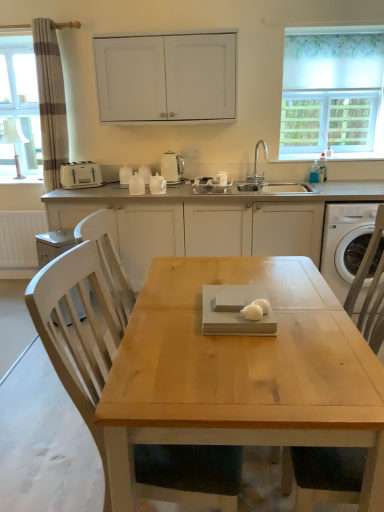
Question: From the image's perspective, relative to white matte cabinetry at center, which ranks as the 2th cabinetry in top-to-bottom order, is white plastic dishwasher at lower left above or below?

Choices:
 (A) above
 (B) below

Answer: (B)

Question: Is white plastic dishwasher at lower left wider or thinner than white matte cabinetry at center, which ranks as the 2th cabinetry in top-to-bottom order?

Choices:
 (A) thin
 (B) wide

Answer: (A)

Question: Considering the real-world distances, which object is closest to the white plastic dishwasher at lower left?

Choices:
 (A) white glossy electric kettle at center
 (B) white textured radiator at lower left
 (C) white plastic washing machine at right
 (D) light wood chair at center
 (E) beige striped curtain at left

Answer: (B)

Question: Estimate the real-world distances between objects in this image. Which object is farther from the white matte cabinetry at center, placed as the 1th cabinetry when sorted from bottom to top?

Choices:
 (A) white plastic dishwasher at lower left
 (B) white glossy electric kettle at center
 (C) white fabric at upper right
 (D) beige striped curtain at left
 (E) white matte cabinet at upper center, which is the 1th cabinetry in top-to-bottom order

Answer: (D)